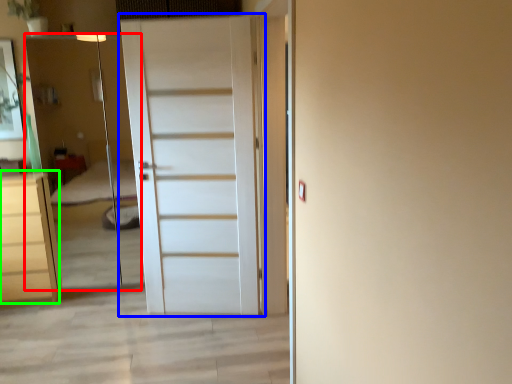
Question: Estimate the real-world distances between objects in this image. Which object is farther from elevator (highlighted by a red box), door (highlighted by a blue box) or chest of drawers (highlighted by a green box)?

Choices:
 (A) door
 (B) chest of drawers

Answer: (A)